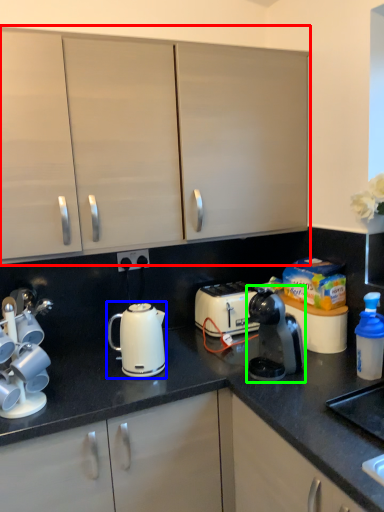
Question: Which object is positioned farthest from cabinetry (highlighted by a red box)? Select from kettle (highlighted by a blue box) and home appliance (highlighted by a green box).

Choices:
 (A) kettle
 (B) home appliance

Answer: (B)